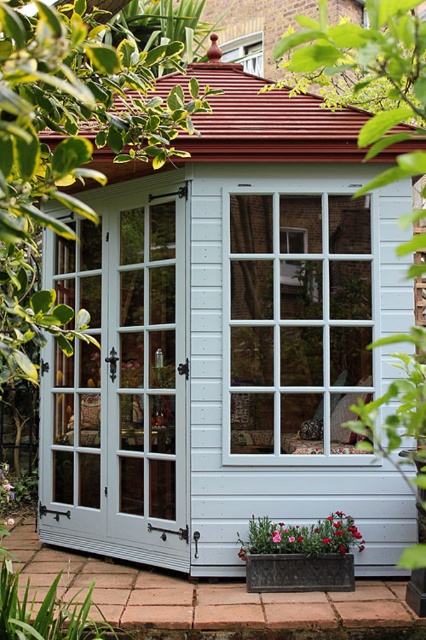
You are standing 15 feet away from the white wooden bay window at center. Can you reach the window without moving closer?

The white wooden bay window at center is 16.48 feet away from the viewer, so you are currently 15 feet away, which means you are closer than the window. Therefore, you can reach the window without moving closer.

You are standing in front of the garden shed and want to place a pink fabric flower exactly at the center of the rectangular planter box. According to the image, is the pink fabric flower at lower center currently positioned to the left or right of the planter box?

The pink fabric flower at lower center is positioned at point [302,536], which is to the right of the planter box.